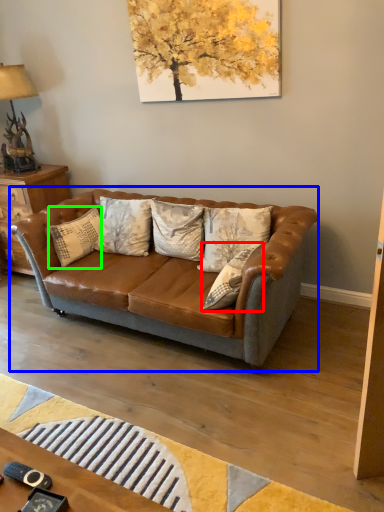
Question: Based on their relative distances, which object is farther from pillow (highlighted by a red box)? Choose from studio couch (highlighted by a blue box) and pillow (highlighted by a green box).

Choices:
 (A) studio couch
 (B) pillow

Answer: (B)